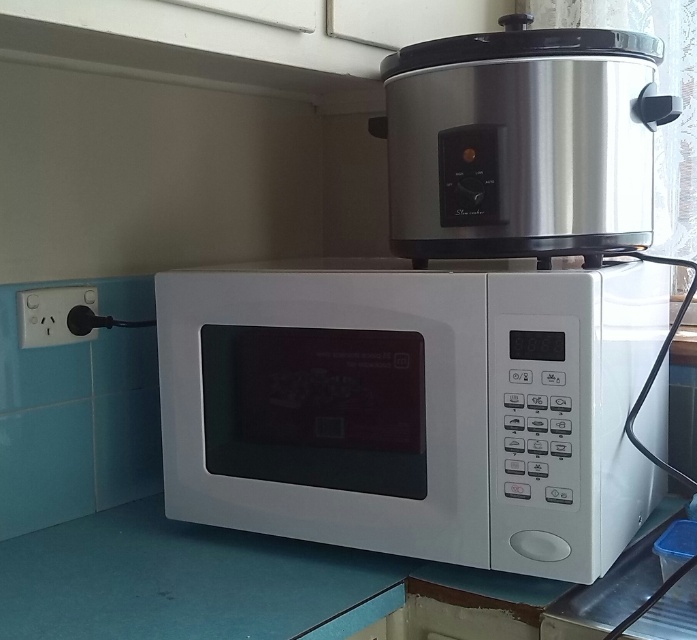
Which of these two, white plastic microwave at center or white glossy countertop at lower center, stands shorter?

white glossy countertop at lower center is shorter.

Does white plastic microwave at center have a greater width compared to white glossy countertop at lower center?

Yes.

What do you see at coordinates (413, 408) in the screenshot?
I see `white plastic microwave at center` at bounding box center [413, 408].

Where is `white plastic microwave at center`? white plastic microwave at center is located at coordinates (413, 408).

Can you confirm if satin silver cooker at upper center is shorter than white glossy countertop at lower center?

Incorrect, satin silver cooker at upper center's height does not fall short of white glossy countertop at lower center's.

Does point (606, 129) come farther from viewer compared to point (254, 552)?

No, it is in front of (254, 552).

This screenshot has width=697, height=640. In order to click on satin silver cooker at upper center in this screenshot , I will do `click(521, 141)`.

Who is lower down, white plastic microwave at center or satin silver cooker at upper center?

Positioned lower is white plastic microwave at center.

The width and height of the screenshot is (697, 640). What do you see at coordinates (413, 408) in the screenshot?
I see `white plastic microwave at center` at bounding box center [413, 408].

At what (x,y) coordinates should I click in order to perform the action: click on white plastic microwave at center. Please return your answer as a coordinate pair (x, y). Looking at the image, I should click on (413, 408).